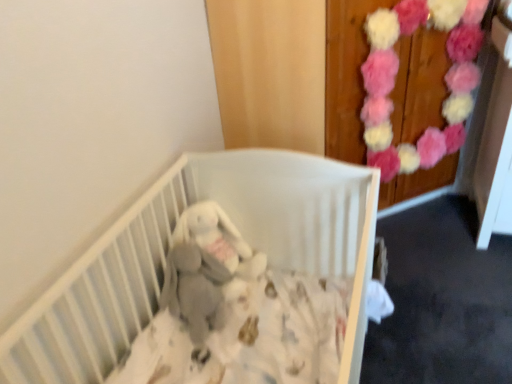
Question: From a real-world perspective, is white matte crib at center under gray plush baby elephant at center?

Choices:
 (A) yes
 (B) no

Answer: (A)

Question: Does white matte crib at center have a greater width compared to gray plush baby elephant at center?

Choices:
 (A) no
 (B) yes

Answer: (B)

Question: Is white matte crib at center outside gray plush baby elephant at center?

Choices:
 (A) yes
 (B) no

Answer: (A)

Question: Can you confirm if white matte crib at center is positioned to the left of gray plush baby elephant at center?

Choices:
 (A) yes
 (B) no

Answer: (B)

Question: Is white matte crib at center aimed at gray plush baby elephant at center?

Choices:
 (A) yes
 (B) no

Answer: (B)

Question: Is white matte crib at center surrounding gray plush baby elephant at center?

Choices:
 (A) no
 (B) yes

Answer: (B)

Question: Considering the relative positions of gray plush baby elephant at center and white matte crib at center in the image provided, is gray plush baby elephant at center to the right of white matte crib at center from the viewer's perspective?

Choices:
 (A) no
 (B) yes

Answer: (A)

Question: Is the depth of gray plush baby elephant at center less than that of white matte crib at center?

Choices:
 (A) yes
 (B) no

Answer: (B)

Question: Is gray plush baby elephant at center wider than white matte crib at center?

Choices:
 (A) yes
 (B) no

Answer: (B)

Question: Is gray plush baby elephant at center aimed at white matte crib at center?

Choices:
 (A) no
 (B) yes

Answer: (B)

Question: Is gray plush baby elephant at center surrounding white matte crib at center?

Choices:
 (A) yes
 (B) no

Answer: (B)

Question: Does gray plush baby elephant at center have a lesser height compared to white matte crib at center?

Choices:
 (A) no
 (B) yes

Answer: (B)

Question: Does puffy fabric flowers at upper right have a lesser height compared to gray plush baby elephant at center?

Choices:
 (A) yes
 (B) no

Answer: (B)